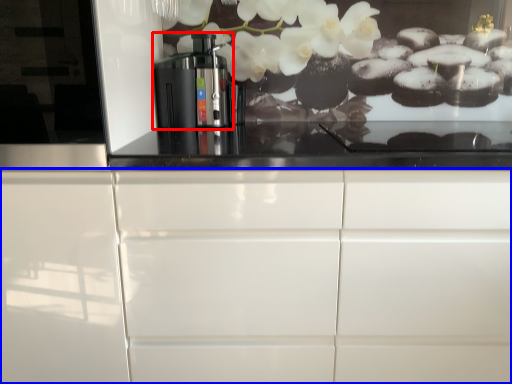
Question: Which object is closer to the camera taking this photo, home appliance (highlighted by a red box) or cabinetry (highlighted by a blue box)?

Choices:
 (A) home appliance
 (B) cabinetry

Answer: (B)